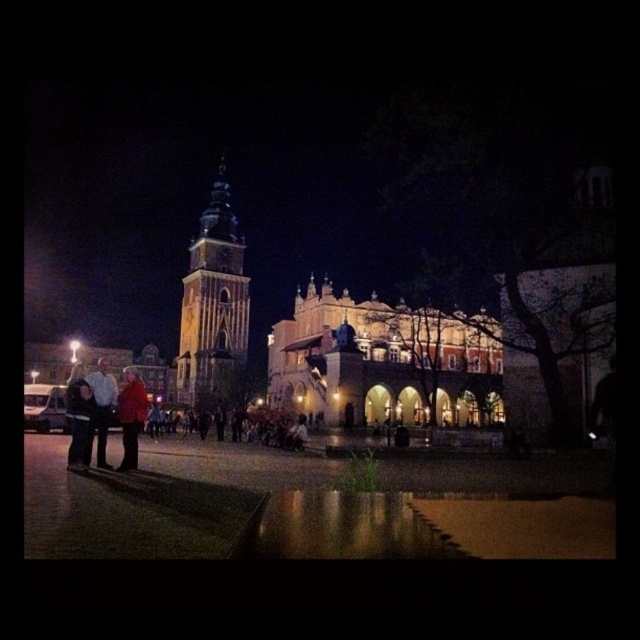
Consider the image. You are a tourist standing in the town square and want to take a photo of the red wool coat at center without the blue glass bell tower at center blocking the view. Is this possible?

The red wool coat at center is behind the blue glass bell tower at center, so you cannot take a photo of the red wool coat at center without the blue glass bell tower at center blocking the view.